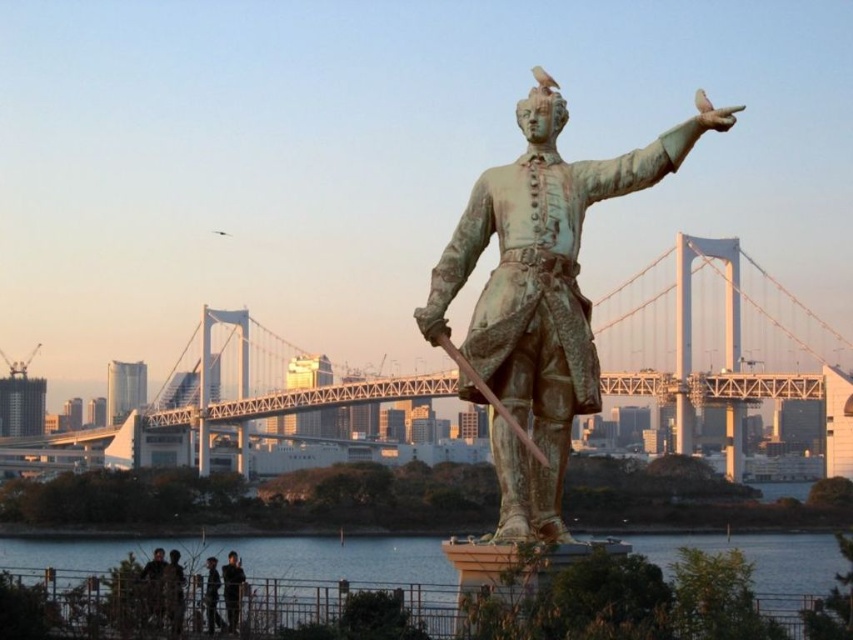
You are a photographer standing at the base of the statue. You want to capture a photo of the dark brown leather jacket at lower left and the greenish water at lower center in the same frame. Which object should you adjust your camera angle to focus on first to ensure both are in the shot?

Since the greenish water at lower center is positioned under the dark brown leather jacket at lower left, you should focus on the dark brown leather jacket at lower left first to ensure both are visible in the frame.

You are standing at the base of the statue and want to take a photo of the greenish water at lower center. Based on its coordinates, in which direction should you point your camera to capture it?

The greenish water at lower center is located at point coordinates, so you should point your camera towards the lower center direction to capture it.